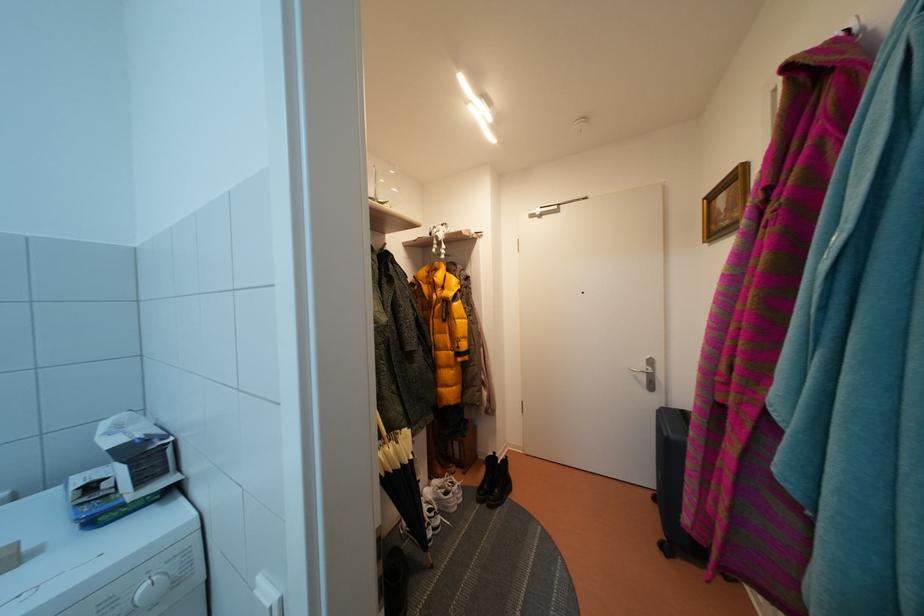
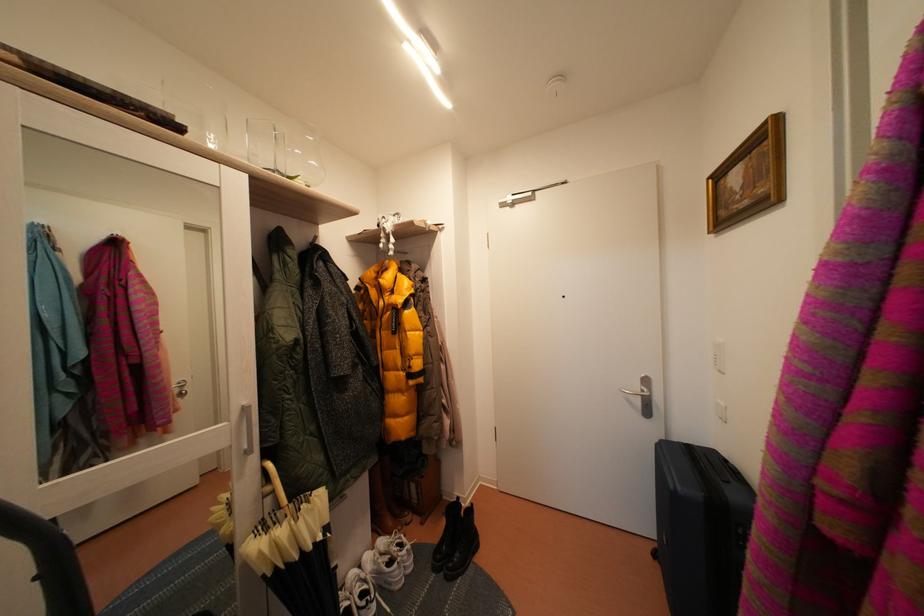
Question: The camera is either moving clockwise (left) or counter-clockwise (right) around the object. The first image is from the beginning of the video and the second image is from the end. Is the camera moving left or right when shooting the video?

Choices:
 (A) Left
 (B) Right

Answer: (A)